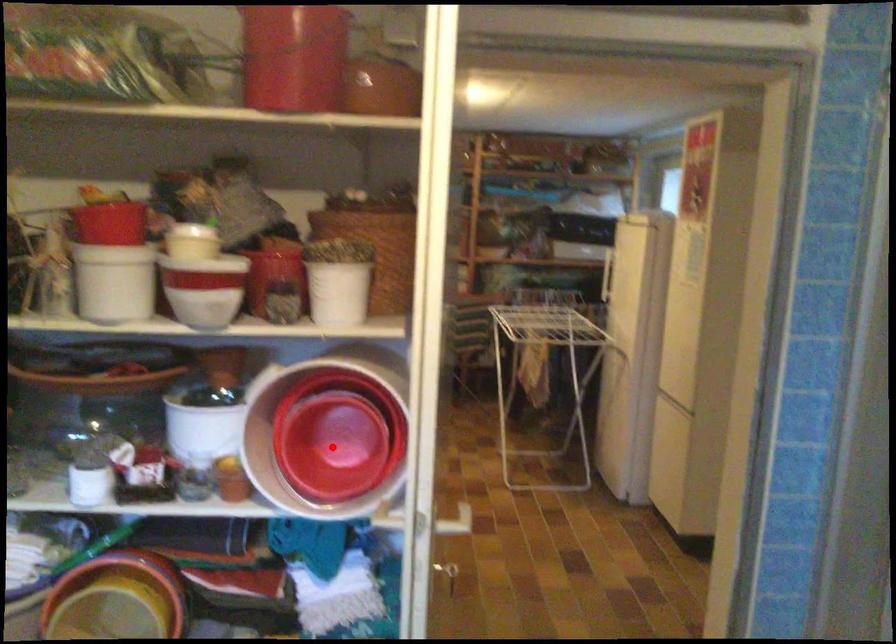
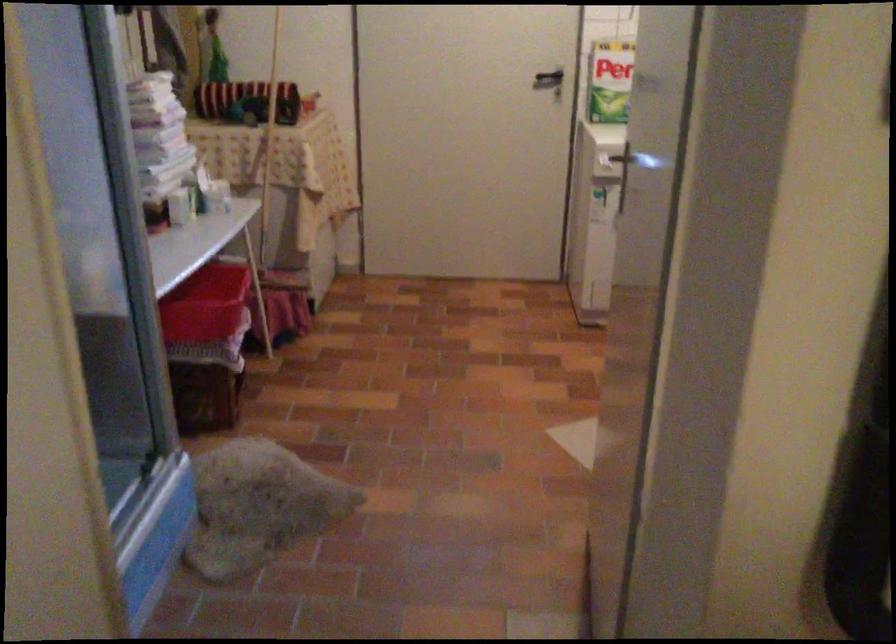
Question: I am providing you with two images of the same scene from different viewpoints. A red point is marked on the first image. Is the red point's position out of view in image 2?

Choices:
 (A) Yes
 (B) No

Answer: (A)